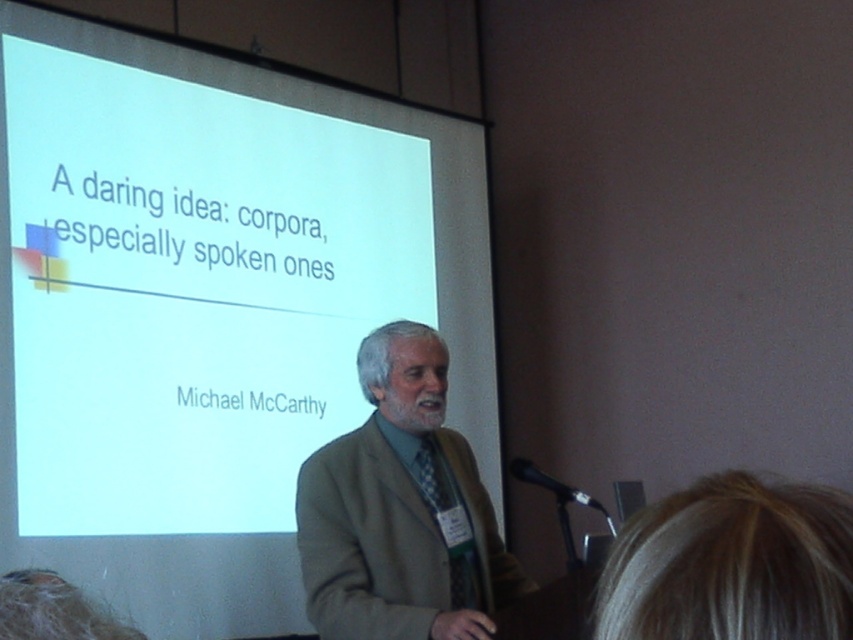
You are an attendee at the presentation and want to see both the slide on the white matte projection screen at upper center and the speaker holding the black plastic microphone at lower right. Is the screen blocking your view of the microphone?

The white matte projection screen at upper center is positioned over the black plastic microphone at lower right, so the screen is blocking the microphone from view.

You are an attendee at the presentation. You want to take a photo of the slide on the white matte projection screen at upper center without blocking the view of others. Where should you position yourself relative to the black plastic microphone at lower right?

You should position yourself behind the black plastic microphone at lower right because the white matte projection screen at upper center is further to the viewer than the black plastic microphone at lower right, so standing behind the microphone allows you to see the screen clearly without obstructing others.